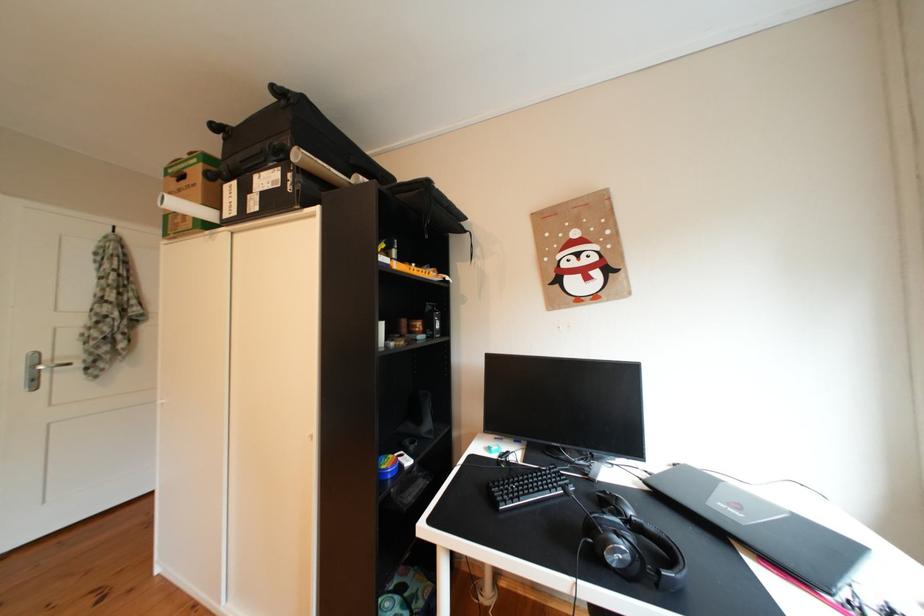
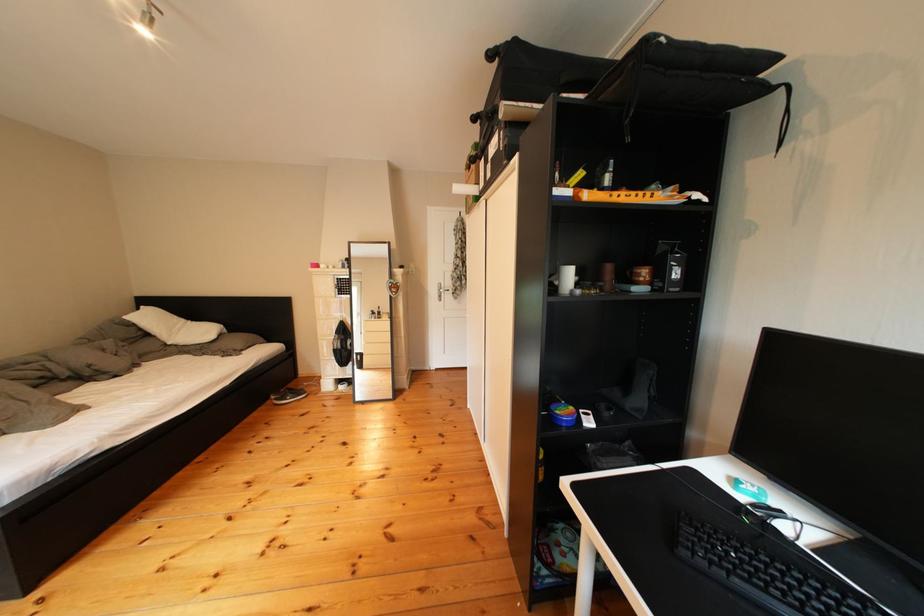
Find the pixel in the second image that matches point (396, 472) in the first image.

(572, 416)